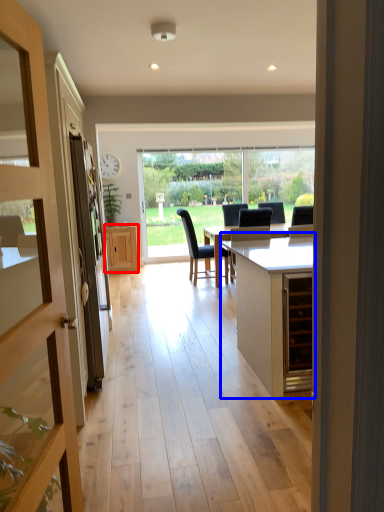
Question: Which object appears closest to the camera in this image, cabinetry (highlighted by a red box) or cabinetry (highlighted by a blue box)?

Choices:
 (A) cabinetry
 (B) cabinetry

Answer: (B)